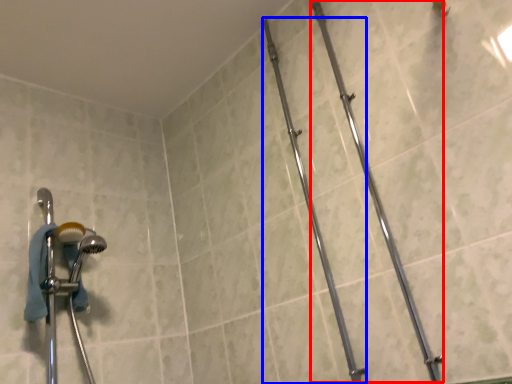
Question: Among these objects, which one is farthest to the camera, pipe (highlighted by a red box) or pipe (highlighted by a blue box)?

Choices:
 (A) pipe
 (B) pipe

Answer: (B)